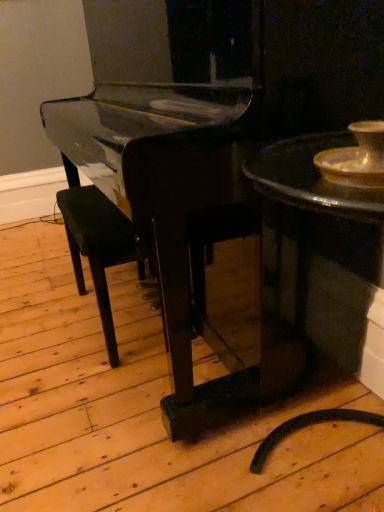
Question: Should I look upward or downward to see shiny dark wood table at right?

Choices:
 (A) up
 (B) down

Answer: (B)

Question: Could you tell me if shiny dark wood table at right is turned towards black wood armchair at center?

Choices:
 (A) yes
 (B) no

Answer: (B)

Question: Is shiny dark wood table at right outside of black wood armchair at center?

Choices:
 (A) no
 (B) yes

Answer: (B)

Question: Is shiny dark wood table at right wider than black wood armchair at center?

Choices:
 (A) no
 (B) yes

Answer: (B)

Question: Is shiny dark wood table at right next to black wood armchair at center and touching it?

Choices:
 (A) no
 (B) yes

Answer: (A)

Question: From a real-world perspective, is shiny dark wood table at right beneath black wood armchair at center?

Choices:
 (A) no
 (B) yes

Answer: (A)

Question: Does shiny dark wood table at right lie in front of black wood armchair at center?

Choices:
 (A) no
 (B) yes

Answer: (B)

Question: Does black wood armchair at center have a lesser height compared to shiny dark wood table at right?

Choices:
 (A) no
 (B) yes

Answer: (B)

Question: Is black wood armchair at center positioned far away from shiny dark wood table at right?

Choices:
 (A) yes
 (B) no

Answer: (B)

Question: Could you tell me if black wood armchair at center is turned towards shiny dark wood table at right?

Choices:
 (A) no
 (B) yes

Answer: (A)

Question: Is black wood armchair at center outside of shiny dark wood table at right?

Choices:
 (A) yes
 (B) no

Answer: (A)

Question: From the image's perspective, is black wood armchair at center located beneath shiny dark wood table at right?

Choices:
 (A) yes
 (B) no

Answer: (B)

Question: Is black wood armchair at center thinner than shiny dark wood table at right?

Choices:
 (A) no
 (B) yes

Answer: (B)

Question: From a real-world perspective, is black wood armchair at center physically located above or below shiny dark wood table at right?

Choices:
 (A) below
 (B) above

Answer: (A)